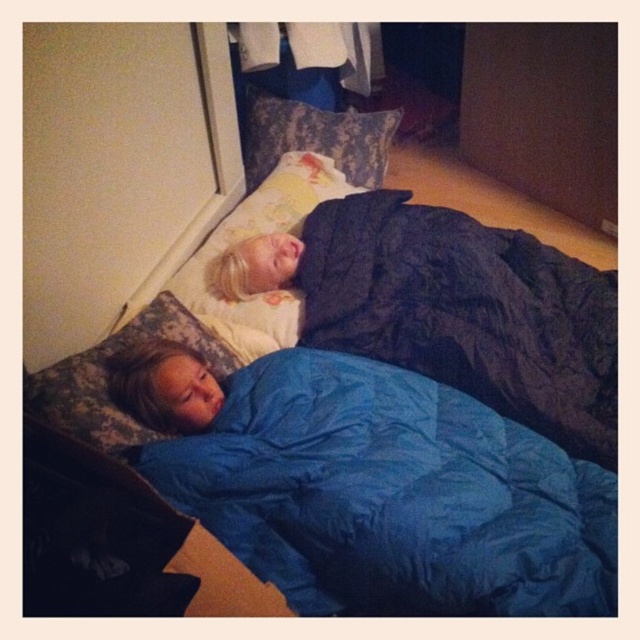
You are trying to locate the yellow floral pillow at upper center and the patterned fabric pillow at upper center on the bed. Which one is positioned to the left side?

The yellow floral pillow at upper center is positioned to the left of the patterned fabric pillow at upper center.